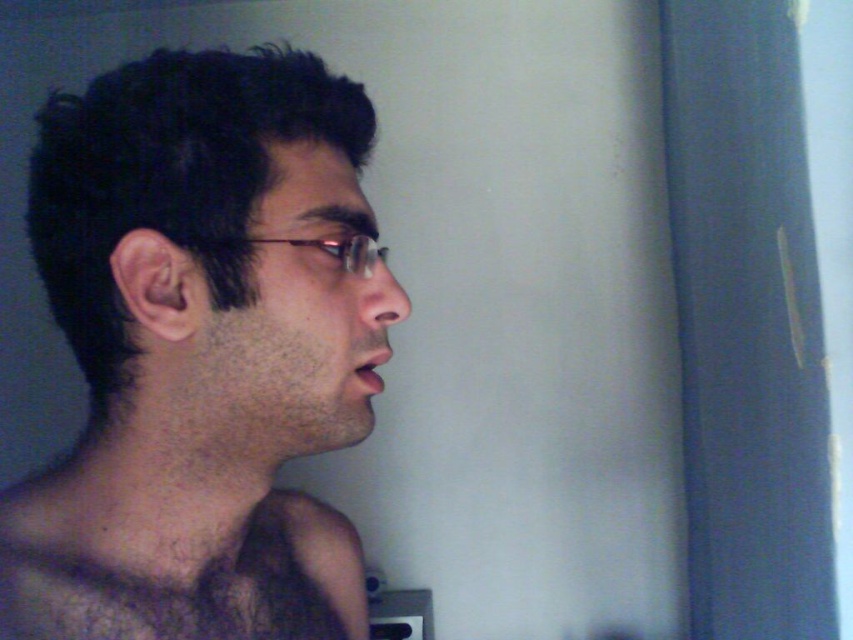
From the picture: You are a photographer adjusting the focus on your camera. You have two subjects in your viewfinder, the dark brown hair at upper left and the dark brown hairy muscle at center. Which subject should you focus on first if you want to ensure both are in focus, given their distance apart?

Since the dark brown hair at upper left and dark brown hairy muscle at center are 3.24 inches apart, you should focus on the dark brown hairy muscle at center first as it is closer to the camera and adjust the focus to include both within the depth of field.

Based on the scene description, which object has a greater width between the dark brown hair at upper left and the dark brown hairy muscle at center?

The dark brown hair at upper left has a greater width than the dark brown hairy muscle at center according to the description.